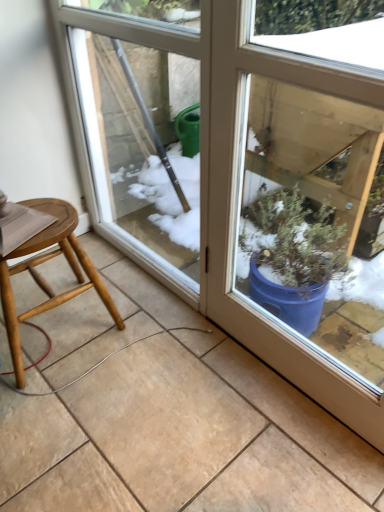
I want to click on vacant space to the right of light wood stool at lower left, so click(148, 335).